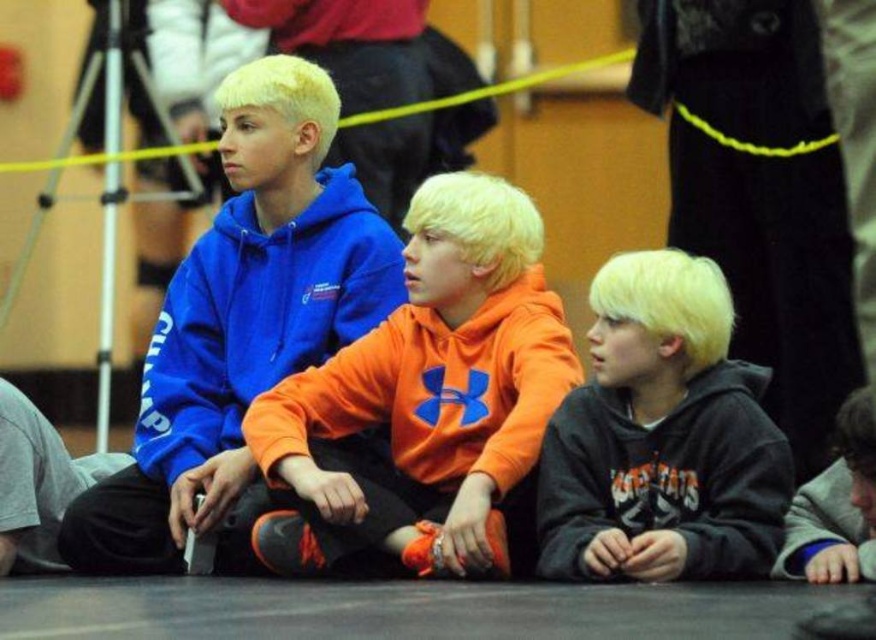
You are organizing a clothing donation drive and need to ensure all hoodies fit into a standard donation bin that has a width capacity of 40 cm. The black matte hoodie at center and the matte blue hoodie at left are both candidates. Which hoodie will definitely fit into the bin based on their widths?

The black matte hoodie at center has a width less than the matte blue hoodie at left. Since the blue hoodie is wider, the black matte hoodie at center is more likely to fit into the 40 cm width donation bin compared to the matte blue hoodie at left.

You are organizing a clothing donation drive and need to determine if the orange fleece sweatshirt at center and the matte blue hoodie at left can fit side by side on a shelf that is 1.2 meters wide. Given their widths, will they both fit?

The orange fleece sweatshirt at center is wider than the matte blue hoodie at left. However, without knowing their exact widths, we cannot determine if together they will fit on a 1.2 meter shelf.

You are a photographer at a basketball game. You need to capture a closeup of the orange fleece sweatshirt at center and the black matte hoodie at center. Which one should you zoom in on to ensure it fills the frame better?

The orange fleece sweatshirt at center is larger in size than the black matte hoodie at center, so you should zoom in on the orange fleece sweatshirt at center to ensure it fills the frame better.